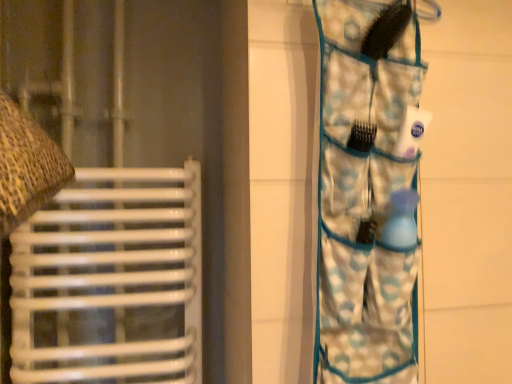
The image size is (512, 384). What do you see at coordinates (119, 192) in the screenshot? I see `matte brown fabric at left` at bounding box center [119, 192].

At what (x,y) coordinates should I click in order to perform the action: click on matte brown fabric at left. Please return your answer as a coordinate pair (x, y). The width and height of the screenshot is (512, 384). Looking at the image, I should click on (119, 192).

Measure the distance between point (353, 357) and camera.

Point (353, 357) is 30.55 inches from camera.

What do you see at coordinates (369, 189) in the screenshot? The image size is (512, 384). I see `blue patterned fabric at right` at bounding box center [369, 189].

Find the location of a particular element. blue patterned fabric at right is located at coordinates (369, 189).

You are a GUI agent. You are given a task and a screenshot of the screen. Output one action in this format:
    pyautogui.click(x=<x>, y=<y>)
    Task: Click on the matte brown fabric at left
    The height and width of the screenshot is (384, 512).
    Given the screenshot: What is the action you would take?
    pyautogui.click(x=119, y=192)

In the scene shown: Between matte brown fabric at left and blue patterned fabric at right, which one appears on the left side from the viewer's perspective?

matte brown fabric at left.

Is matte brown fabric at left closer to the viewer compared to blue patterned fabric at right?

No, matte brown fabric at left is further to the viewer.

Is point (32, 252) positioned after point (380, 315)?

Yes, it is.

From the image's perspective, is matte brown fabric at left positioned above or below blue patterned fabric at right?

matte brown fabric at left is situated higher than blue patterned fabric at right in the image.

In the scene shown: From a real-world perspective, which object stands above the other?

In real-world perspective, matte brown fabric at left is above.

Considering the sizes of objects matte brown fabric at left and blue patterned fabric at right in the image provided, who is wider, matte brown fabric at left or blue patterned fabric at right?

Wider between the two is matte brown fabric at left.

Can you confirm if matte brown fabric at left is shorter than blue patterned fabric at right?

No.

Can you confirm if matte brown fabric at left is bigger than blue patterned fabric at right?

Yes.

Is matte brown fabric at left not inside blue patterned fabric at right?

Indeed, matte brown fabric at left is completely outside blue patterned fabric at right.

From the picture: Are matte brown fabric at left and blue patterned fabric at right far apart?

No, there isn't a large distance between matte brown fabric at left and blue patterned fabric at right.

Is matte brown fabric at left facing away from blue patterned fabric at right?

No, matte brown fabric at left's orientation is not away from blue patterned fabric at right.

How different are the orientations of matte brown fabric at left and blue patterned fabric at right in degrees?

The angular difference between matte brown fabric at left and blue patterned fabric at right is 2.76 degrees.

Locate an element on the screen. curtain above the blue patterned fabric at right (from the image's perspective) is located at coordinates (119, 192).

Considering the positions of objects blue patterned fabric at right and matte brown fabric at left in the image provided, who is more to the left, blue patterned fabric at right or matte brown fabric at left?

matte brown fabric at left is more to the left.

Which object is closer to the camera, blue patterned fabric at right or matte brown fabric at left?

blue patterned fabric at right is more forward.

Does point (373, 57) come behind point (46, 280)?

No, (373, 57) is in front of (46, 280).

From the image's perspective, is blue patterned fabric at right under matte brown fabric at left?

Yes, from the image's perspective, blue patterned fabric at right is below matte brown fabric at left.

From a real-world perspective, is blue patterned fabric at right positioned under matte brown fabric at left based on gravity?

Indeed, from a real-world perspective, blue patterned fabric at right is positioned beneath matte brown fabric at left.

Is blue patterned fabric at right wider or thinner than matte brown fabric at left?

blue patterned fabric at right is thinner than matte brown fabric at left.

Considering the relative sizes of blue patterned fabric at right and matte brown fabric at left in the image provided, is blue patterned fabric at right taller than matte brown fabric at left?

No.

Considering the sizes of objects blue patterned fabric at right and matte brown fabric at left in the image provided, who is smaller, blue patterned fabric at right or matte brown fabric at left?

blue patterned fabric at right.

Is blue patterned fabric at right situated inside matte brown fabric at left or outside?

blue patterned fabric at right cannot be found inside matte brown fabric at left.

Are blue patterned fabric at right and matte brown fabric at left far apart?

Actually, blue patterned fabric at right and matte brown fabric at left are a little close together.

Is blue patterned fabric at right turned away from matte brown fabric at left?

blue patterned fabric at right is not turned away from matte brown fabric at left.

Locate an element on the screen. Image resolution: width=512 pixels, height=384 pixels. curtain that is behind the blue patterned fabric at right is located at coordinates (119, 192).

You are a GUI agent. You are given a task and a screenshot of the screen. Output one action in this format:
    pyautogui.click(x=<x>, y=<y>)
    Task: Click on the curtain behind the blue patterned fabric at right
    The height and width of the screenshot is (384, 512).
    Given the screenshot: What is the action you would take?
    pyautogui.click(x=119, y=192)

I want to click on camouflage in front of the matte brown fabric at left, so coord(369,189).